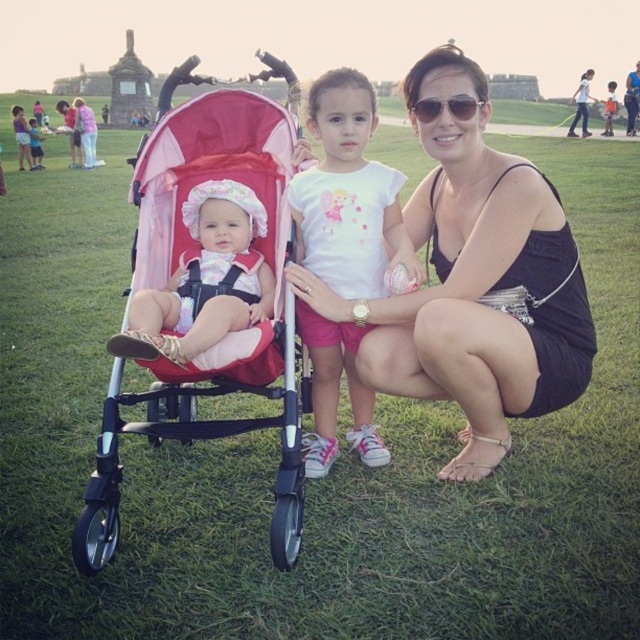
Is black satin dress at center below white cotton shirt at center?

No.

Does black satin dress at center have a greater height compared to white cotton shirt at center?

Correct, black satin dress at center is much taller as white cotton shirt at center.

Does point (490, 300) come behind point (353, 209)?

That is True.

Identify the location of black satin dress at center. tap(476, 284).

From the picture: Between black satin dress at center and pink fabric stroller at left, which one is positioned higher?

black satin dress at center is higher up.

Can you confirm if black satin dress at center is positioned to the left of pink fabric stroller at left?

No, black satin dress at center is not to the left of pink fabric stroller at left.

Which is in front, point (381, 358) or point (272, 356)?

Point (272, 356) is more forward.

Where is `black satin dress at center`? The width and height of the screenshot is (640, 640). black satin dress at center is located at coordinates pos(476,284).

Is point (376, 372) in front of point (196, 234)?

No.

The width and height of the screenshot is (640, 640). What do you see at coordinates (476, 284) in the screenshot?
I see `black satin dress at center` at bounding box center [476, 284].

Identify the location of black satin dress at center. (476, 284).